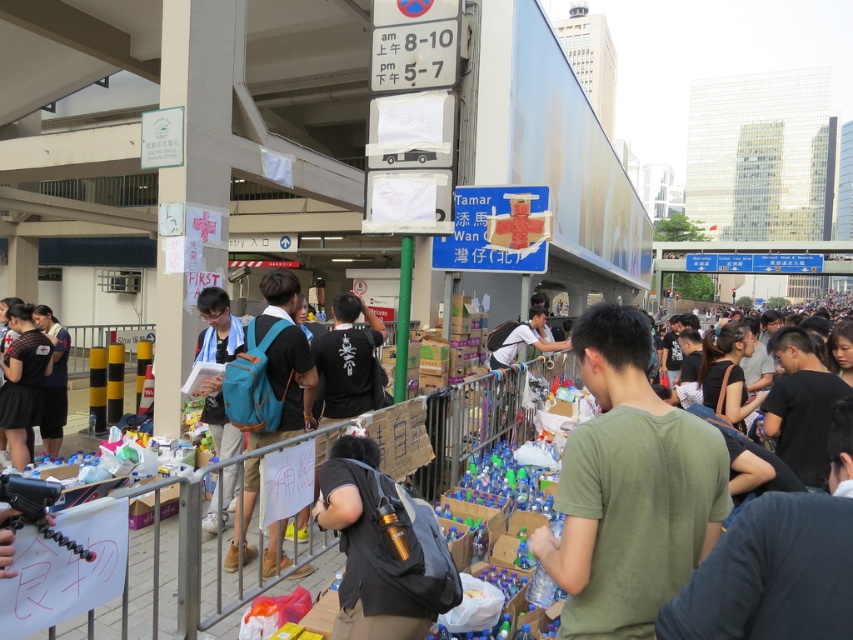
Who is more forward, (390, 611) or (44, 435)?

Point (390, 611) is more forward.

Is metallic gold water bottle at center smaller than dark blue backpack at left?

Yes, metallic gold water bottle at center is smaller than dark blue backpack at left.

Identify the location of metallic gold water bottle at center. Image resolution: width=853 pixels, height=640 pixels. coord(381,548).

Image resolution: width=853 pixels, height=640 pixels. In order to click on metallic gold water bottle at center in this screenshot , I will do `click(381, 548)`.

Can you confirm if teal fabric backpack at center is shorter than light blue backpack at center?

No, teal fabric backpack at center is not shorter than light blue backpack at center.

Does point (305, 426) lie behind point (558, 340)?

No, it is in front of (558, 340).

Which is behind, point (282, 403) or point (538, 336)?

The point (538, 336) is behind.

Where is `teal fabric backpack at center`? The image size is (853, 640). teal fabric backpack at center is located at coordinates (280, 358).

Who is taller, teal fabric backpack at center or dark gray fabric shirt at left?

With more height is teal fabric backpack at center.

Is teal fabric backpack at center to the left of dark gray fabric shirt at left from the viewer's perspective?

In fact, teal fabric backpack at center is to the right of dark gray fabric shirt at left.

Describe the element at coordinates (280, 358) in the screenshot. I see `teal fabric backpack at center` at that location.

At what (x,y) coordinates should I click in order to perform the action: click on teal fabric backpack at center. Please return your answer as a coordinate pair (x, y). The width and height of the screenshot is (853, 640). Looking at the image, I should click on (280, 358).